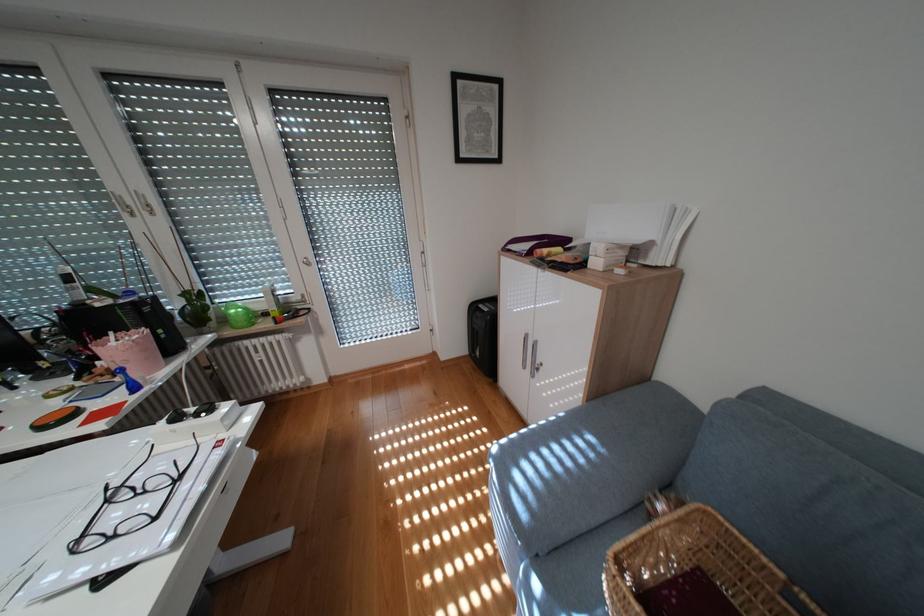
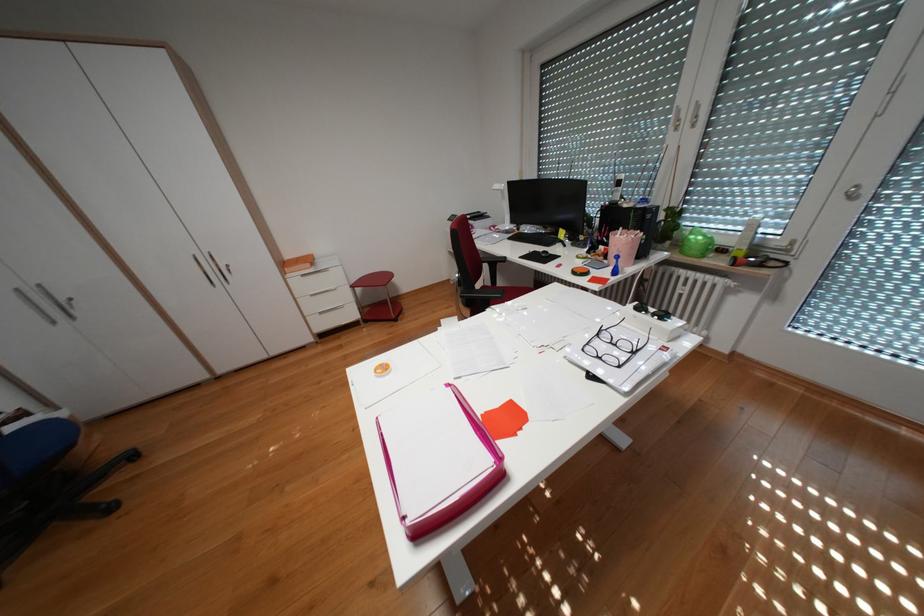
Find the pixel in the second image that matches the point at 119,501 in the first image.

(610, 334)